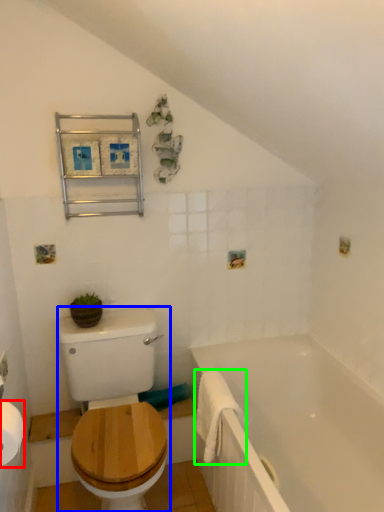
Question: Based on their relative distances, which object is nearer to toilet paper (highlighted by a red box)? Choose from sit (highlighted by a blue box) and bath towel (highlighted by a green box).

Choices:
 (A) sit
 (B) bath towel

Answer: (A)